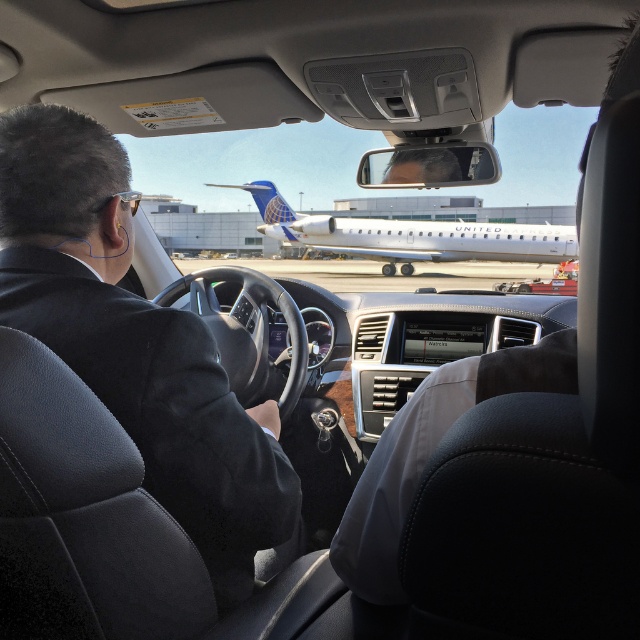
Which is above, dark gray suit at center or white metallic airplane at center?

Positioned higher is white metallic airplane at center.

This screenshot has width=640, height=640. Describe the element at coordinates (134, 342) in the screenshot. I see `dark gray suit at center` at that location.

Measure the distance between dark gray suit at center and camera.

dark gray suit at center is 3.38 feet from camera.

Locate an element on the screen. dark gray suit at center is located at coordinates (134, 342).